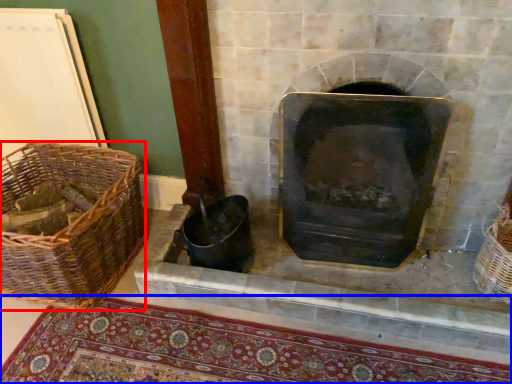
Question: Among these objects, which one is farthest to the camera, basket (highlighted by a red box) or mat (highlighted by a blue box)?

Choices:
 (A) basket
 (B) mat

Answer: (A)